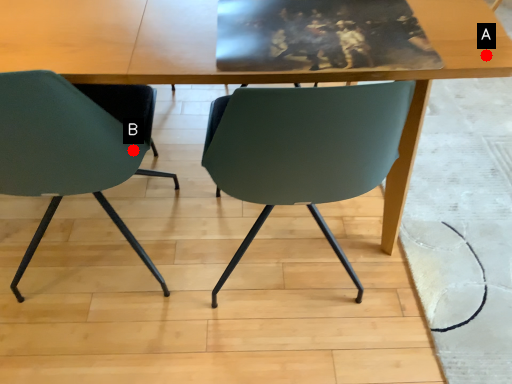
Question: Two points are circled on the image, labeled by A and B beside each circle. Which point is farther from the camera taking this photo?

Choices:
 (A) A is further
 (B) B is further

Answer: (B)